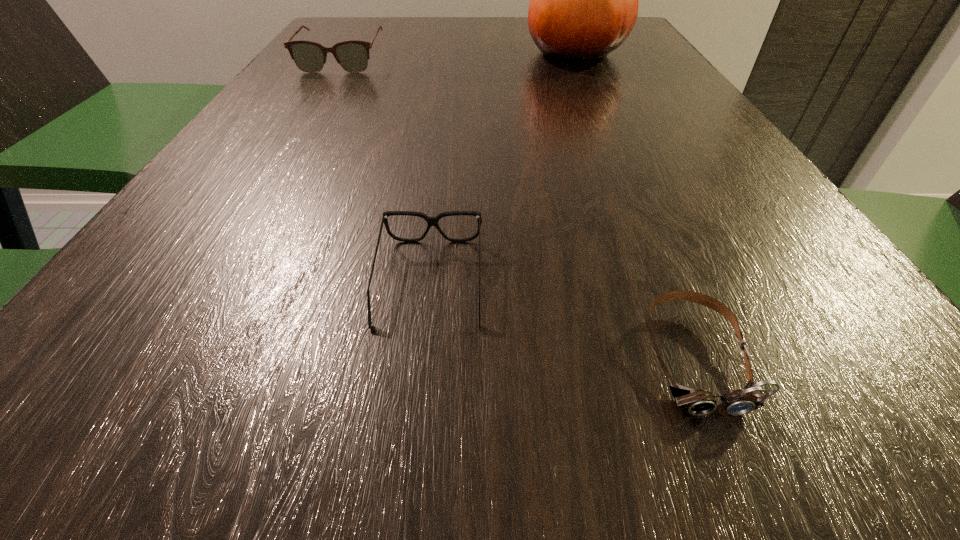
Where is `object located in the near edge section of the desktop`? This screenshot has width=960, height=540. object located in the near edge section of the desktop is located at coordinates (698, 402).

Image resolution: width=960 pixels, height=540 pixels. What are the coordinates of `object located at the left edge` in the screenshot? It's located at (352, 55).

Locate an element on the screen. The width and height of the screenshot is (960, 540). pumpkin that is positioned at the right edge is located at coordinates (584, 0).

Image resolution: width=960 pixels, height=540 pixels. I want to click on goggles that is at the right edge, so click(x=698, y=402).

The image size is (960, 540). Identify the location of object positioned at the far right corner. (584, 0).

The image size is (960, 540). I want to click on object situated at the near right corner, so click(698, 402).

Locate an element on the screen. vacant space at the far edge is located at coordinates (410, 18).

The width and height of the screenshot is (960, 540). What are the coordinates of `free region at the near edge of the desktop` in the screenshot? It's located at (349, 451).

Locate an element on the screen. Image resolution: width=960 pixels, height=540 pixels. free space at the left edge is located at coordinates (352, 74).

Where is `free region at the right edge of the desktop`? Image resolution: width=960 pixels, height=540 pixels. free region at the right edge of the desktop is located at coordinates (669, 146).